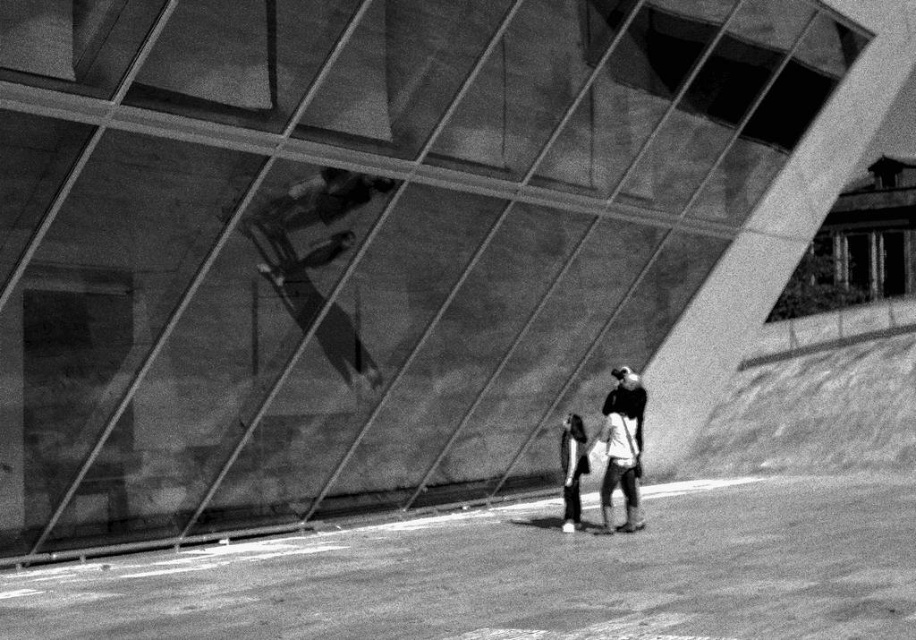
Question: Which point appears closest to the camera in this image?

Choices:
 (A) pyautogui.click(x=292, y=262)
 (B) pyautogui.click(x=630, y=493)
 (C) pyautogui.click(x=573, y=477)

Answer: (B)

Question: Is smooth black skateboard at center thinner than white cotton shirt at center?

Choices:
 (A) no
 (B) yes

Answer: (A)

Question: Can you confirm if smooth black skateboard at center is wider than white cotton shirt at center?

Choices:
 (A) yes
 (B) no

Answer: (A)

Question: Among these objects, which one is farthest from the camera?

Choices:
 (A) white cotton shirt at center
 (B) smooth black skateboard at center

Answer: (B)

Question: Which point appears closest to the camera in this image?

Choices:
 (A) [x=638, y=424]
 (B) [x=298, y=308]
 (C) [x=578, y=426]

Answer: (A)

Question: Considering the relative positions of smooth black skateboard at center and white cotton shirt at center in the image provided, where is smooth black skateboard at center located with respect to white cotton shirt at center?

Choices:
 (A) right
 (B) left

Answer: (B)